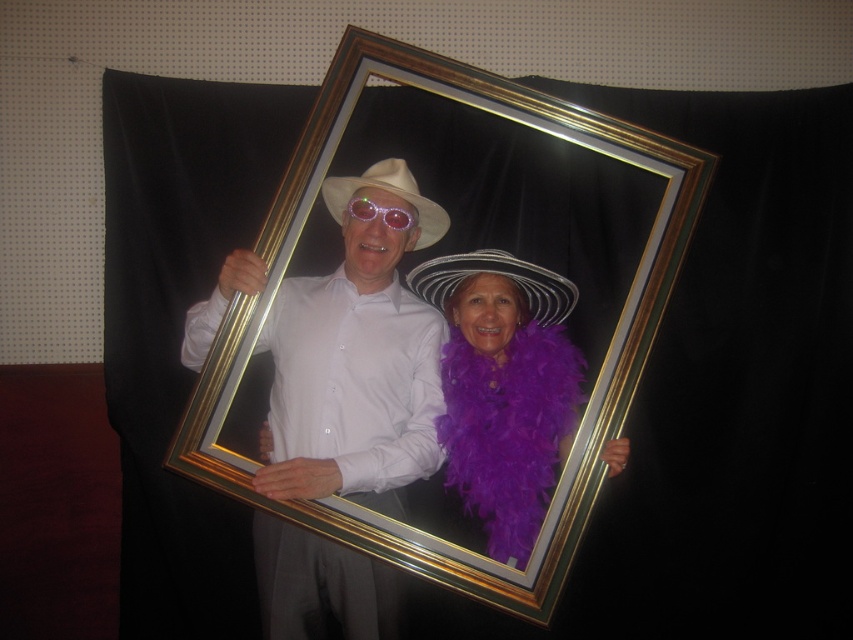
You are an artist trying to recreate the scene in the mirror. You need to place the purple feather boa at center in your drawing. According to the coordinates provided, where should you position it?

The purple feather boa at center should be placed at the coordinates point (503,387) to accurately recreate its position in the original scene.

You are trying to determine if the purple feather boa at center can be placed over the translucent plastic goggles at center without blocking the view. Based on their sizes, is this possible?

The purple feather boa at center might be wider than translucent plastic goggles at center, so placing it over might block the view.